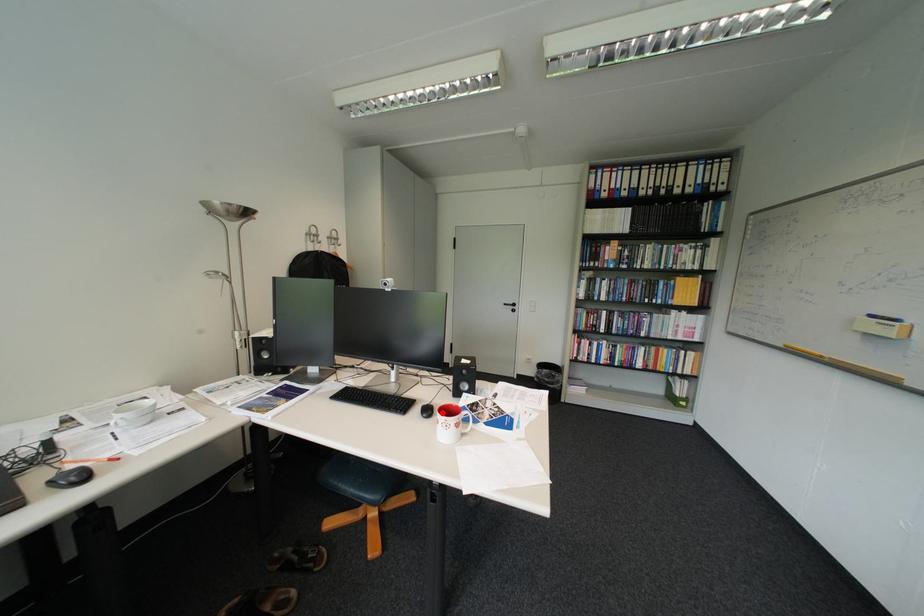
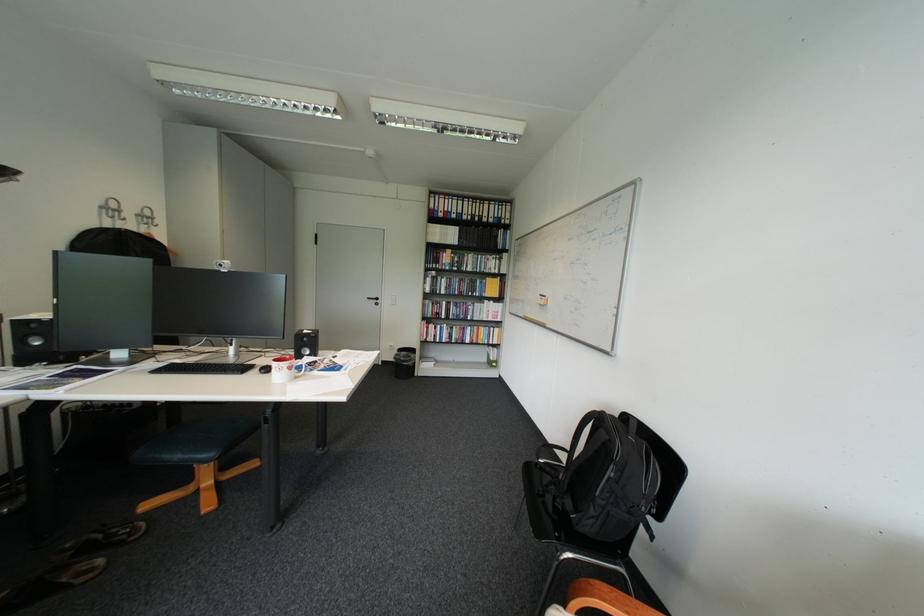
Where in the second image is the point corresponding to the highlighted location from the first image?

(281, 370)